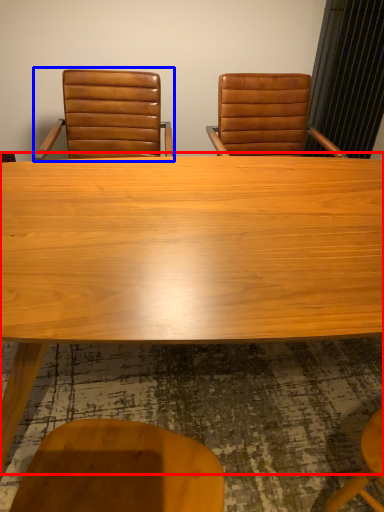
Question: Among these objects, which one is farthest to the camera, table (highlighted by a red box) or chair (highlighted by a blue box)?

Choices:
 (A) table
 (B) chair

Answer: (B)